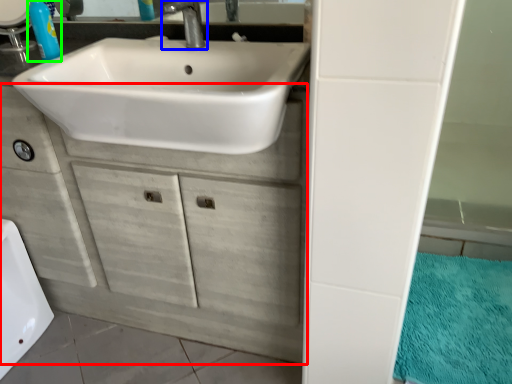
Question: Considering the real-world distances, which object is farthest from bathroom cabinet (highlighted by a red box)? tap (highlighted by a blue box) or soap dispenser (highlighted by a green box)?

Choices:
 (A) tap
 (B) soap dispenser

Answer: (A)